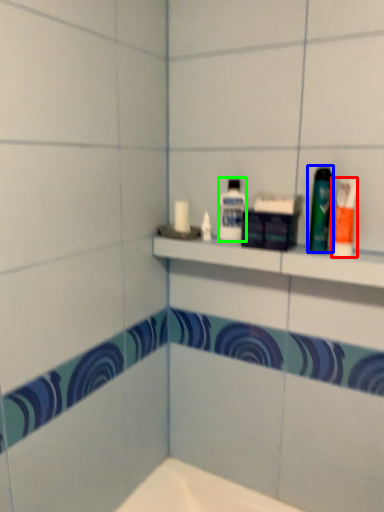
Question: Considering the real-world distances, which object is farthest from toiletry (highlighted by a red box)? mouthwash (highlighted by a blue box) or mouthwash (highlighted by a green box)?

Choices:
 (A) mouthwash
 (B) mouthwash

Answer: (B)